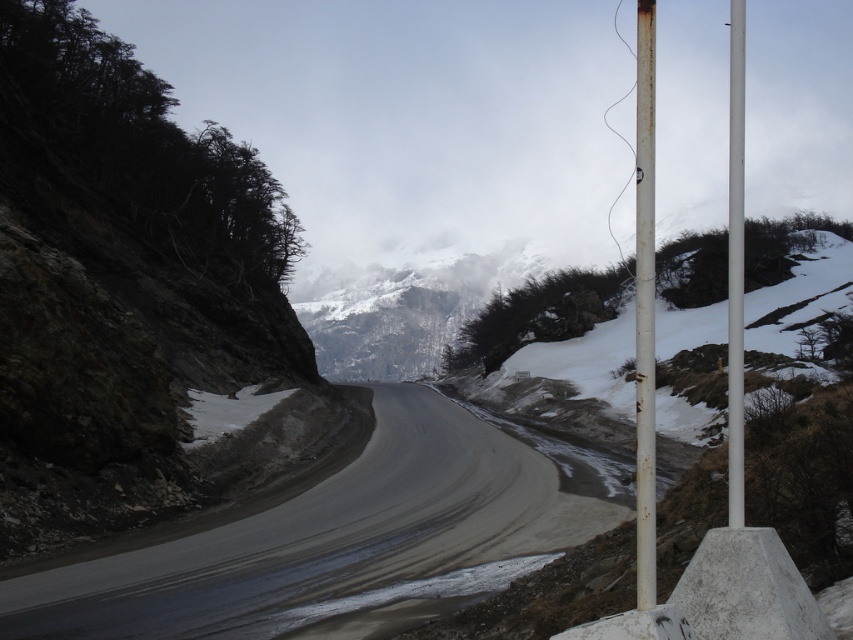
You are driving along the winding mountain road and see two points marked on the map. The first point is at coordinate point (643, 396) and the second is at coordinate point (738, 250). If you continue driving forward, which point will you reach first?

You will reach point (643, 396) first because it is in front of point (738, 250) along the road direction.

You are a delivery driver navigating a mountain road in winter conditions. Your GPS indicates a potential hazard at the point marked by coordinates point (335, 544). Based on the scene description, what is the most likely terrain feature at this point?

The point (335, 544) marks smooth asphalt road at center, so the most likely terrain feature at this point is the road itself, which is smooth and made of asphalt.